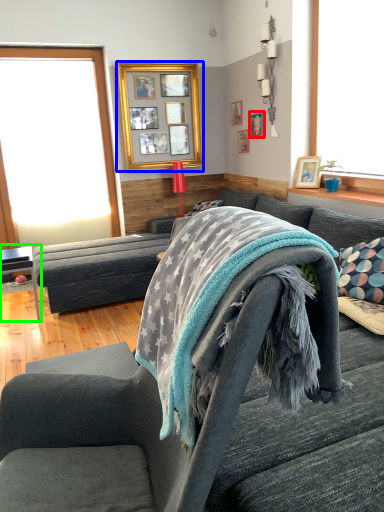
Question: Which is farther away from picture frame (highlighted by a red box)? picture frame (highlighted by a blue box) or table (highlighted by a green box)?

Choices:
 (A) picture frame
 (B) table

Answer: (B)